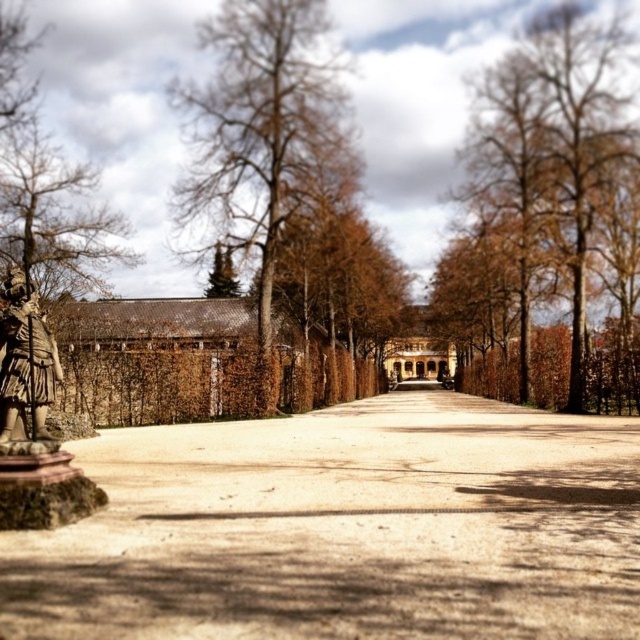
Does brown textured wall at center have a lesser width compared to bronze statue at left?

In fact, brown textured wall at center might be wider than bronze statue at left.

Can you confirm if brown textured wall at center is positioned to the left of bronze statue at left?

Indeed, brown textured wall at center is positioned on the left side of bronze statue at left.

The image size is (640, 640). Describe the element at coordinates (264, 138) in the screenshot. I see `brown textured wall at center` at that location.

Identify the location of brown textured wall at center. The width and height of the screenshot is (640, 640). (264, 138).

Which is above, brown textured tree at center or bronze statue at left?

Positioned higher is brown textured tree at center.

Who is more distant from viewer, (595, 122) or (12, 323)?

The point (595, 122) is more distant.

At what (x,y) coordinates should I click in order to perform the action: click on brown textured tree at center. Please return your answer as a coordinate pair (x, y). This screenshot has width=640, height=640. Looking at the image, I should click on (547, 188).

Is brown gravel driveway at center wider than brown textured wall at center?

Indeed, brown gravel driveway at center has a greater width compared to brown textured wall at center.

At what (x,y) coordinates should I click in order to perform the action: click on brown gravel driveway at center. Please return your answer as a coordinate pair (x, y). The image size is (640, 640). Looking at the image, I should click on (346, 529).